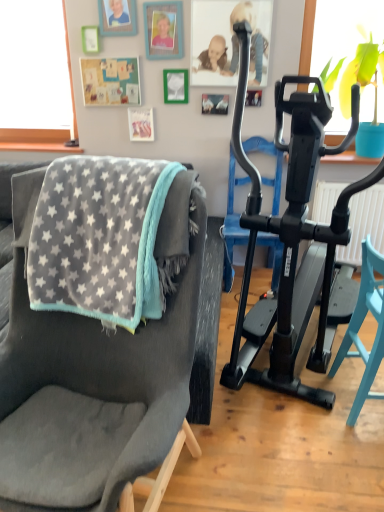
Question: Does black plastic stationary bicycle at right have a lesser width compared to translucent glass window screen at upper right?

Choices:
 (A) yes
 (B) no

Answer: (B)

Question: Is black plastic stationary bicycle at right aimed at translucent glass window screen at upper right?

Choices:
 (A) yes
 (B) no

Answer: (B)

Question: From a real-world perspective, is black plastic stationary bicycle at right over translucent glass window screen at upper right?

Choices:
 (A) yes
 (B) no

Answer: (B)

Question: Can you confirm if black plastic stationary bicycle at right is taller than translucent glass window screen at upper right?

Choices:
 (A) yes
 (B) no

Answer: (A)

Question: Is black plastic stationary bicycle at right wider than translucent glass window screen at upper right?

Choices:
 (A) yes
 (B) no

Answer: (A)

Question: From the image's perspective, would you say black plastic stationary bicycle at right is shown under translucent glass window screen at upper right?

Choices:
 (A) no
 (B) yes

Answer: (B)

Question: Is translucent glass window screen at upper right located outside gray fleece blanket at left?

Choices:
 (A) no
 (B) yes

Answer: (B)

Question: From a real-world perspective, is translucent glass window screen at upper right beneath gray fleece blanket at left?

Choices:
 (A) no
 (B) yes

Answer: (A)

Question: Is the depth of translucent glass window screen at upper right greater than that of gray fleece blanket at left?

Choices:
 (A) no
 (B) yes

Answer: (B)

Question: Can you see translucent glass window screen at upper right touching gray fleece blanket at left?

Choices:
 (A) yes
 (B) no

Answer: (B)

Question: Considering the relative sizes of translucent glass window screen at upper right and gray fleece blanket at left in the image provided, is translucent glass window screen at upper right shorter than gray fleece blanket at left?

Choices:
 (A) no
 (B) yes

Answer: (A)

Question: Is translucent glass window screen at upper right thinner than gray fleece blanket at left?

Choices:
 (A) yes
 (B) no

Answer: (A)

Question: Is black rubber exercise machine at right wider than soft gray fabric chair at left, the first chair when ordered from left to right?

Choices:
 (A) no
 (B) yes

Answer: (A)